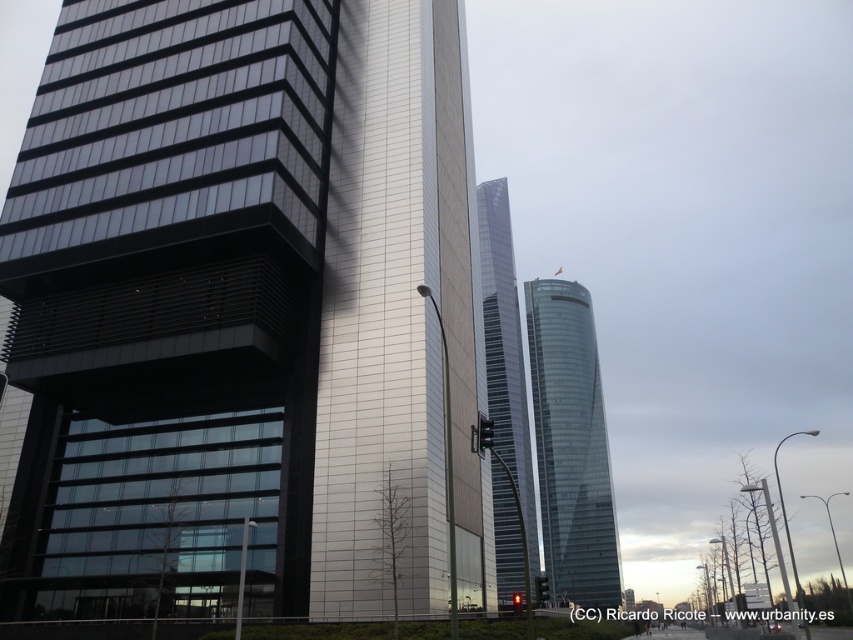
Does glassy steel building at center have a greater width compared to glassy steel tower at center?

Correct, the width of glassy steel building at center exceeds that of glassy steel tower at center.

Which of these two, glassy steel building at center or glassy steel tower at center, stands shorter?

Standing shorter between the two is glassy steel building at center.

In order to click on glassy steel building at center in this screenshot , I will do `click(241, 314)`.

The width and height of the screenshot is (853, 640). Find the location of `glassy steel building at center`. glassy steel building at center is located at coordinates (241, 314).

Which is more to the right, glassy steel building at center or transparent glass tower at center?

transparent glass tower at center

Is glassy steel building at center thinner than transparent glass tower at center?

Incorrect, glassy steel building at center's width is not less than transparent glass tower at center's.

Where is `glassy steel building at center`? glassy steel building at center is located at coordinates coord(241,314).

Where is `glassy steel building at center`? The image size is (853, 640). glassy steel building at center is located at coordinates (241, 314).

Between transparent glass tower at center and glassy steel tower at center, which one appears on the left side from the viewer's perspective?

From the viewer's perspective, glassy steel tower at center appears more on the left side.

Can you confirm if transparent glass tower at center is positioned to the left of glassy steel tower at center?

In fact, transparent glass tower at center is to the right of glassy steel tower at center.

Who is more forward, (618, 552) or (514, 269)?

Point (618, 552)

The image size is (853, 640). Find the location of `transparent glass tower at center`. transparent glass tower at center is located at coordinates (572, 445).